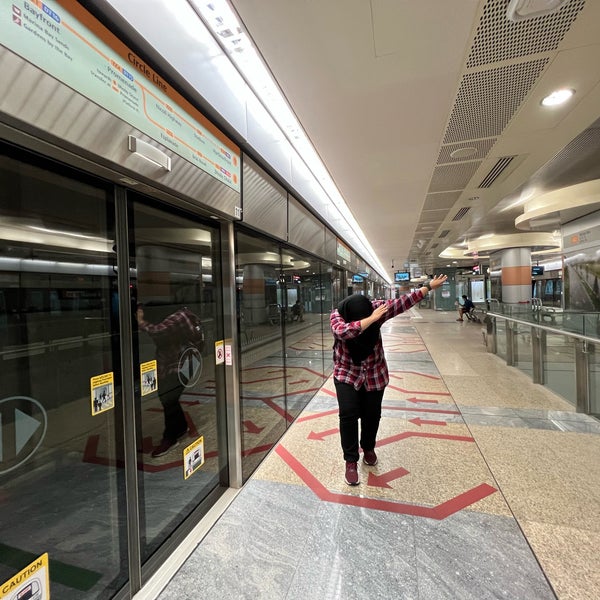
The image size is (600, 600). I want to click on air vents, so click(503, 42), click(499, 101), click(446, 180), click(443, 157), click(438, 203), click(438, 220), click(423, 243), click(425, 237).